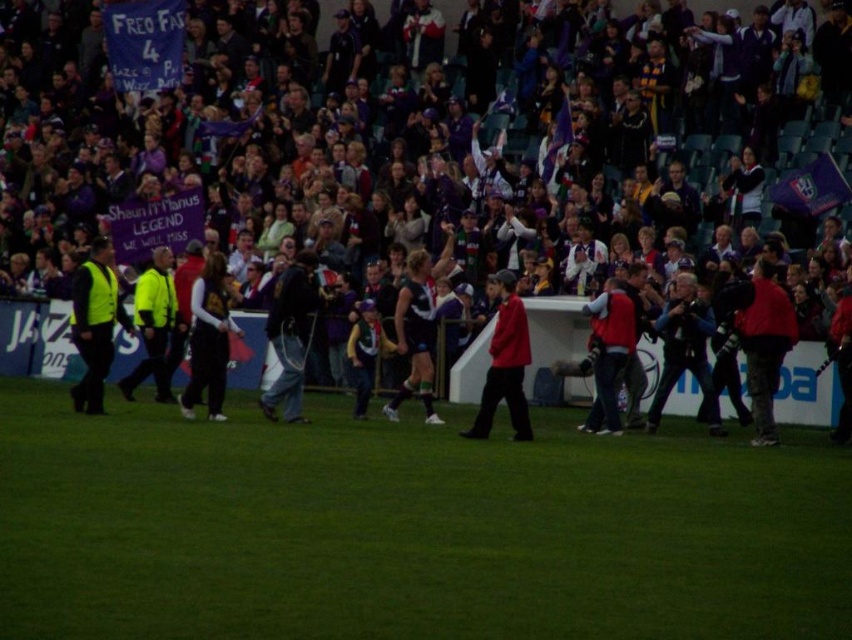
You are standing at the edge of the field in the stadium and want to throw a ball to a friend. You have two points to aim for in the image. Which point, point (429,593) or point (219,413), is closer to you?

Point (429,593) is closer to the viewer than point (219,413), so you should aim for point (429,593).

You are a photographer at the stadium and need to capture both the dark gray fabric jacket at center and the red matte jacket at center in a single shot. Which jacket will appear larger in the photo?

The dark gray fabric jacket at center will appear larger in the photo because it is much taller than the red matte jacket at center.

You are a photographer positioned at the edge of the field. You want to capture a photo that includes both the green grass at center and the red matte jacket at center. Which object should you adjust your camera focus to first to ensure it is in the foreground?

The green grass at center is in front of the red matte jacket at center, so you should focus on the green grass at center first to ensure it is in the foreground.